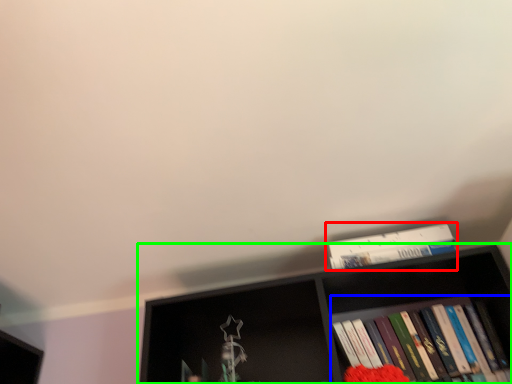
Question: Considering the real-world distances, which object is farthest from book (highlighted by a red box)? book (highlighted by a blue box) or shelf (highlighted by a green box)?

Choices:
 (A) book
 (B) shelf

Answer: (A)